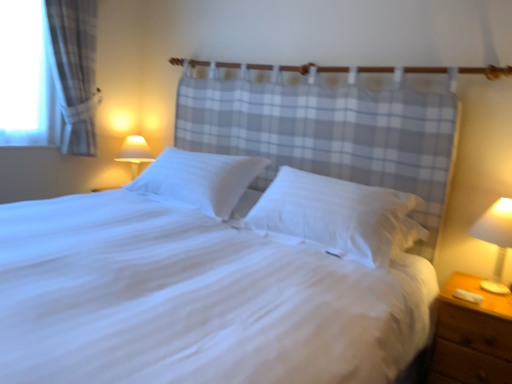
Question: Is white smooth bed at center inside the boundaries of brown wooden nightstand at lower right, or outside?

Choices:
 (A) outside
 (B) inside

Answer: (A)

Question: Does point (188, 283) appear closer or farther from the camera than point (456, 375)?

Choices:
 (A) closer
 (B) farther

Answer: (A)

Question: Which of these objects is positioned closest to the brown wooden nightstand at lower right?

Choices:
 (A) white plastic lamp at right
 (B) white soft pillow at center, which appears as the 1th pillow when viewed from the right
 (C) matte white lampshade at upper left
 (D) white smooth pillow at center, which appears as the 1th pillow when viewed from the left
 (E) white smooth bed at center

Answer: (A)

Question: Which object is the closest to the white plastic lamp at right?

Choices:
 (A) brown wooden nightstand at lower right
 (B) white smooth bed at center
 (C) matte white lampshade at upper left
 (D) white smooth pillow at center, acting as the second pillow starting from the right
 (E) white soft pillow at center, which is the second pillow in left-to-right order

Answer: (A)